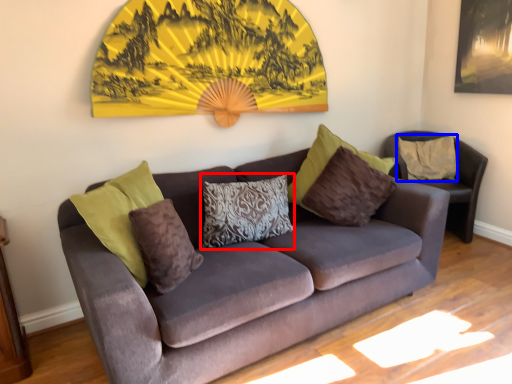
Question: Which object is further to the camera taking this photo, pillow (highlighted by a red box) or pillow (highlighted by a blue box)?

Choices:
 (A) pillow
 (B) pillow

Answer: (B)